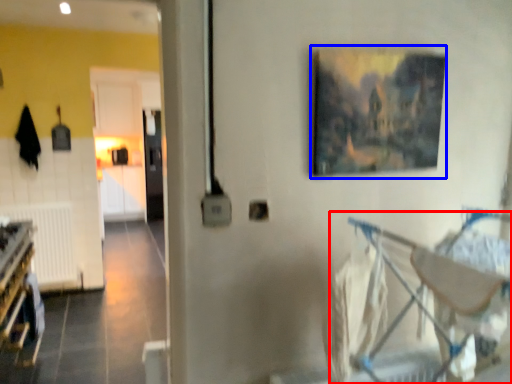
Question: Which object appears closest to the camera in this image, baby carriage (highlighted by a red box) or picture frame (highlighted by a blue box)?

Choices:
 (A) baby carriage
 (B) picture frame

Answer: (A)